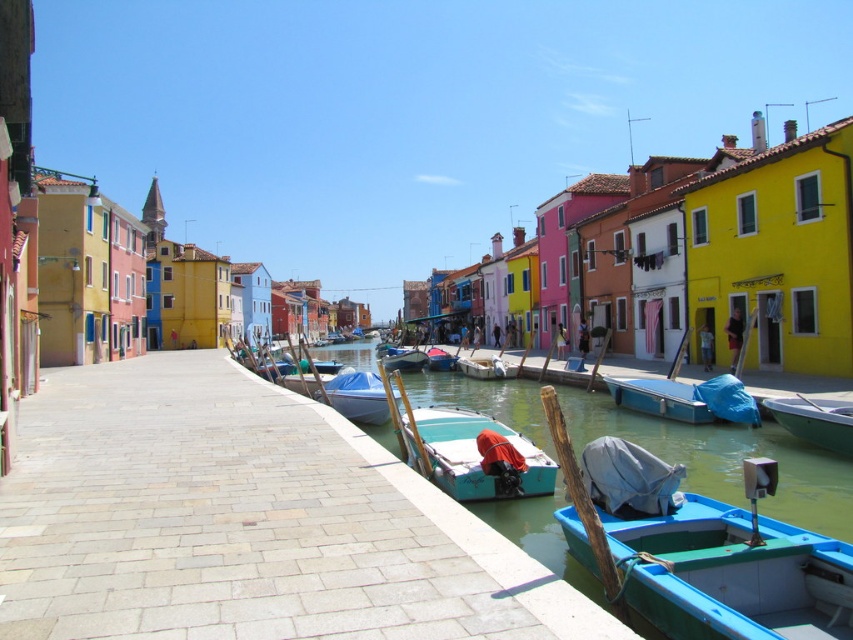
Question: Is blue tarp-covered boat at center above white matte boat at center?

Choices:
 (A) no
 (B) yes

Answer: (A)

Question: Which of these objects is positioned farthest from the white matte boat at center?

Choices:
 (A) teal plastic boat at center
 (B) smooth white boat at center
 (C) teal matte boat at center
 (D) blue tarp-covered boat at center

Answer: (C)

Question: Is green matte boat at lower right closer to camera compared to blue tarp-covered boat at center?

Choices:
 (A) no
 (B) yes

Answer: (B)

Question: Which object is farther from the camera taking this photo?

Choices:
 (A) blue plastic boat at lower right
 (B) smooth concrete dock at center
 (C) blue tarp-covered boat at center

Answer: (C)

Question: Does blue plastic boat at lower right appear on the right side of green matte boat at lower right?

Choices:
 (A) no
 (B) yes

Answer: (A)

Question: Based on their relative distances, which object is nearer to the smooth white boat at center?

Choices:
 (A) smooth concrete dock at center
 (B) teal plastic boat at center
 (C) blue tarpaulin boat at center
 (D) blue plastic boat at lower right

Answer: (B)